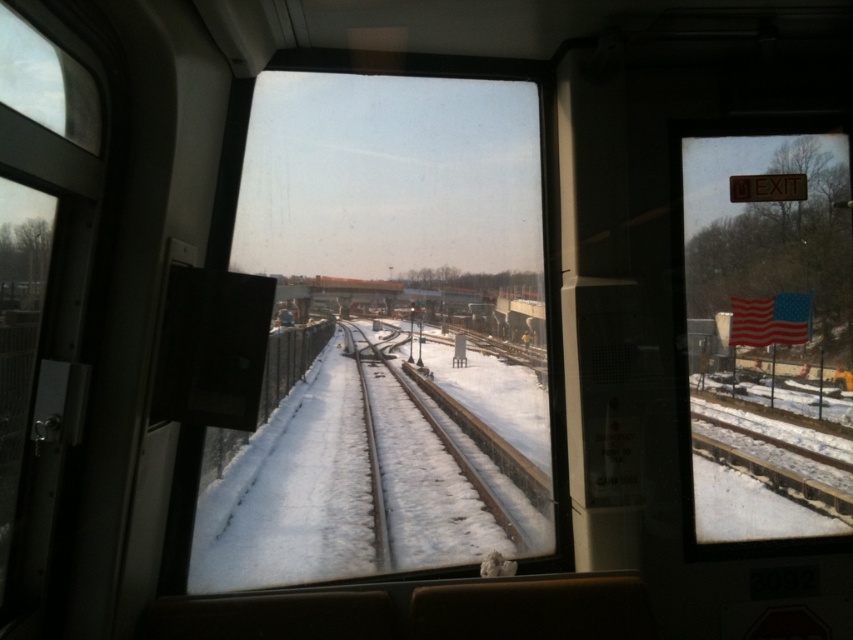
Question: Is transparent glass train window at center positioned at the back of clear glass flag at upper right?

Choices:
 (A) no
 (B) yes

Answer: (A)

Question: Which is nearer to the clear glass flag at upper right?

Choices:
 (A) snow-covered tracks at center
 (B) transparent glass train window at center

Answer: (A)

Question: Which point is closer to the camera taking this photo?

Choices:
 (A) (511, 534)
 (B) (310, 276)

Answer: (B)

Question: Which of the following is the farthest from the observer?

Choices:
 (A) clear glass flag at upper right
 (B) transparent glass train window at center

Answer: (A)

Question: Can you confirm if clear glass flag at upper right is positioned below snow-covered tracks at center?

Choices:
 (A) no
 (B) yes

Answer: (A)

Question: Is clear glass flag at upper right bigger than snow-covered tracks at center?

Choices:
 (A) no
 (B) yes

Answer: (A)